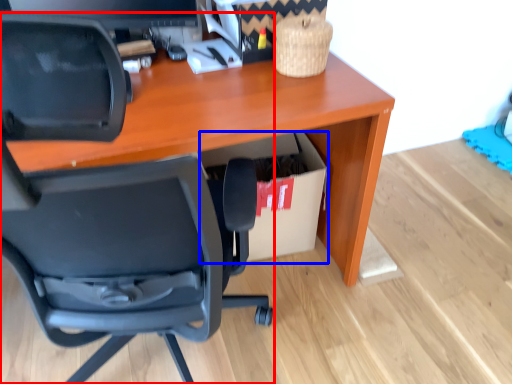
Question: Which of the following is the farthest to the observer, chair (highlighted by a red box) or cardboard box (highlighted by a blue box)?

Choices:
 (A) chair
 (B) cardboard box

Answer: (B)